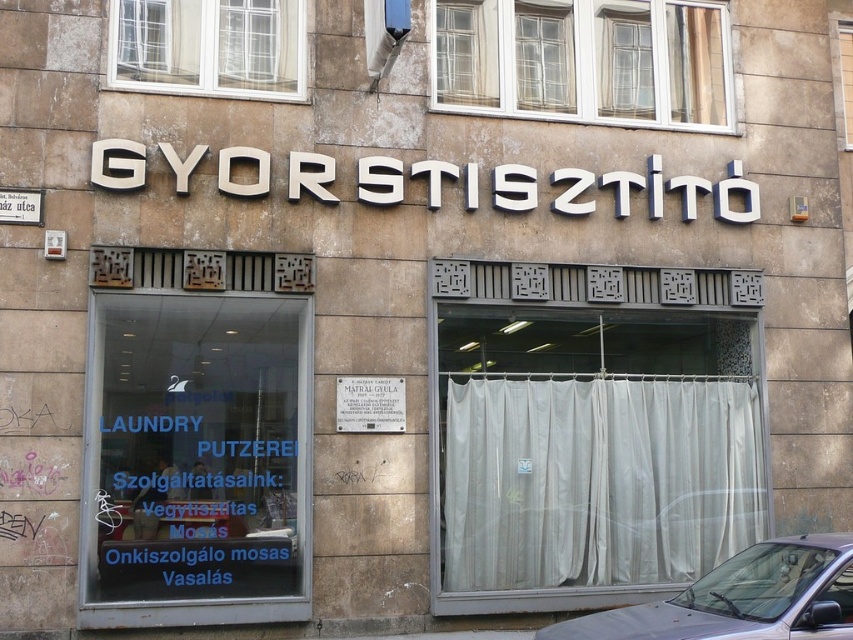
What is the significance of the point at coordinates (196, 438) in the image?

The point at coordinates (196, 438) indicates the location of the transparent glass laundry sign at center.

You are a delivery person trying to park your gray metallic car at lower right near the transparent glass laundry sign at center. Can you fit the car next to the sign without overlapping it?

The transparent glass laundry sign at center has a lesser width compared to gray metallic car at lower right, so the car is wider than the sign. Therefore, it might be challenging to park the gray metallic car at lower right next to the transparent glass laundry sign at center without overlapping, as the car is wider.